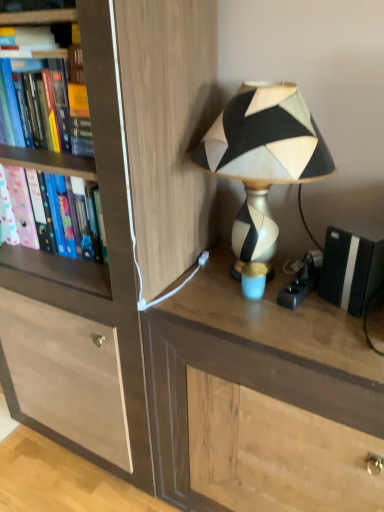
At what (x,y) coordinates should I click in order to perform the action: click on free space in front of black and white geometric lampshade at upper right. Please return your answer as a coordinate pair (x, y). Image resolution: width=384 pixels, height=512 pixels. Looking at the image, I should click on (288, 333).